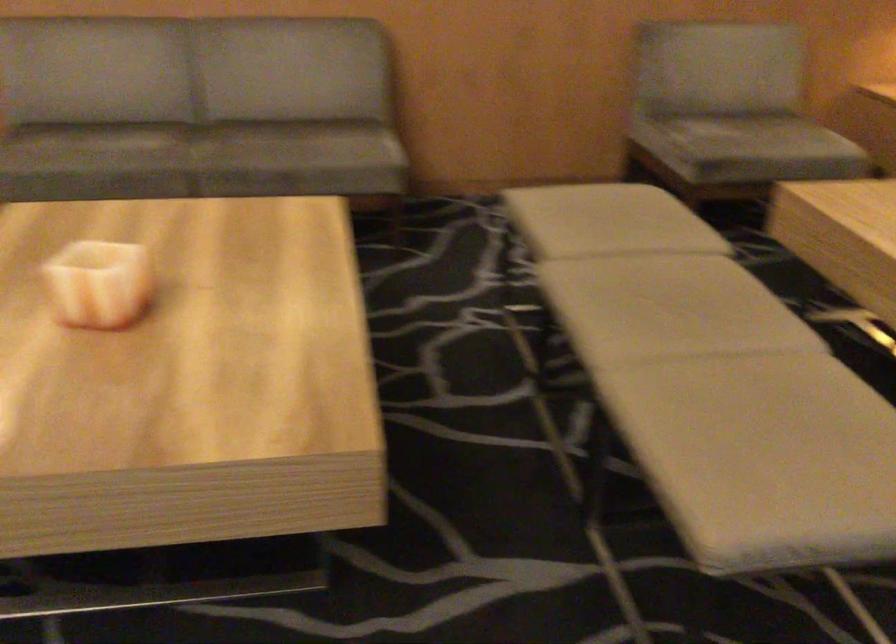
Find where to sit the chair sitting surface. Please return your answer as a coordinate pair (x, y).

(744, 138)